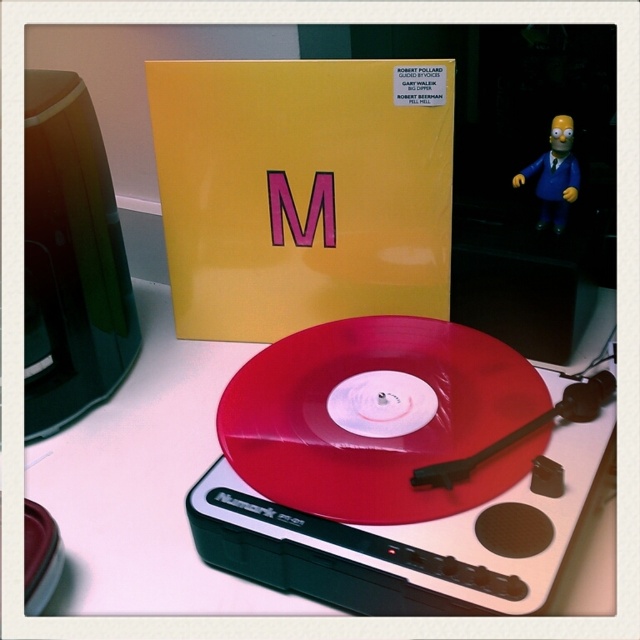
Is white plastic turntable at center positioned in front of blue plastic homer simpson figurine at upper right?

That is True.

Can you confirm if white plastic turntable at center is positioned above blue plastic homer simpson figurine at upper right?

No, white plastic turntable at center is not above blue plastic homer simpson figurine at upper right.

The height and width of the screenshot is (640, 640). I want to click on white plastic turntable at center, so click(x=145, y=484).

Image resolution: width=640 pixels, height=640 pixels. In order to click on white plastic turntable at center in this screenshot , I will do `click(145, 484)`.